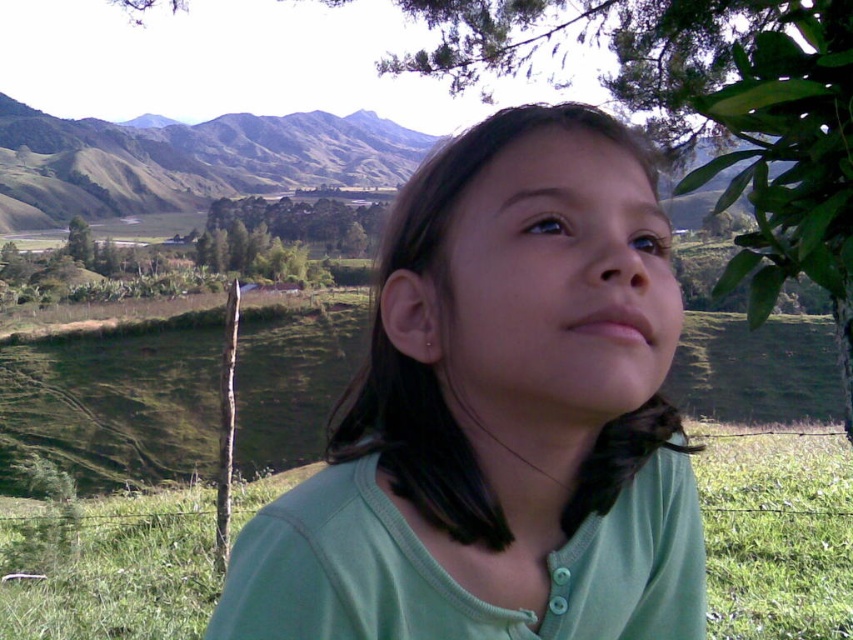
Which is more to the left, green matte shirt at center or green grassy mountain at upper left?

Positioned to the left is green grassy mountain at upper left.

Who is shorter, green matte shirt at center or green grassy mountain at upper left?

green matte shirt at center

The width and height of the screenshot is (853, 640). What are the coordinates of `green matte shirt at center` in the screenshot? It's located at (498, 416).

This screenshot has height=640, width=853. I want to click on green matte shirt at center, so click(498, 416).

Does green leafy tree at upper right appear over green leafy tree at center?

No.

This screenshot has height=640, width=853. I want to click on green leafy tree at upper right, so click(703, 112).

Is green leafy tree at upper right shorter than green grassy mountain at upper left?

Yes, green leafy tree at upper right is shorter than green grassy mountain at upper left.

Does green leafy tree at upper right have a lesser width compared to green grassy mountain at upper left?

Indeed, green leafy tree at upper right has a lesser width compared to green grassy mountain at upper left.

Does point (799, 20) come in front of point (48, 129)?

Yes, point (799, 20) is in front of point (48, 129).

At what (x,y) coordinates should I click in order to perform the action: click on green leafy tree at upper right. Please return your answer as a coordinate pair (x, y). This screenshot has height=640, width=853. Looking at the image, I should click on (703, 112).